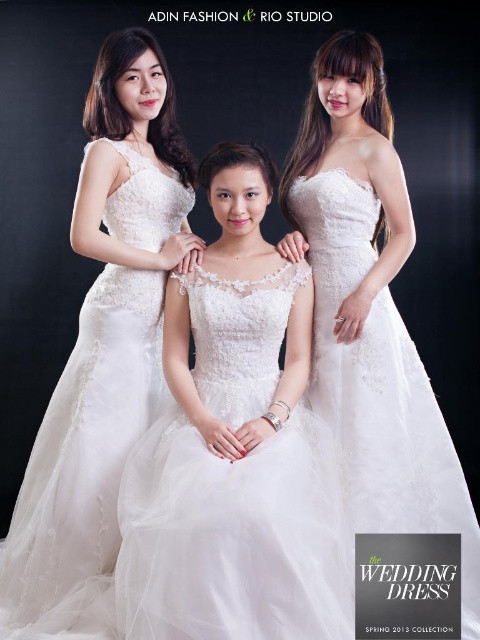
Question: Which of these objects is positioned closest to the white lace dress at upper right?

Choices:
 (A) white lace dress at center
 (B) lace fabric wedding dress at center

Answer: (A)

Question: Does white lace dress at center appear under white lace dress at upper right?

Choices:
 (A) yes
 (B) no

Answer: (A)

Question: Can you confirm if white lace dress at center is smaller than white lace dress at upper right?

Choices:
 (A) no
 (B) yes

Answer: (A)

Question: Which object is farther from the camera taking this photo?

Choices:
 (A) lace fabric wedding dress at center
 (B) white lace dress at center

Answer: (A)

Question: Is white lace dress at center to the right of lace fabric wedding dress at center from the viewer's perspective?

Choices:
 (A) yes
 (B) no

Answer: (A)

Question: Estimate the real-world distances between objects in this image. Which object is farther from the white lace dress at center?

Choices:
 (A) white lace dress at upper right
 (B) lace fabric wedding dress at center

Answer: (B)